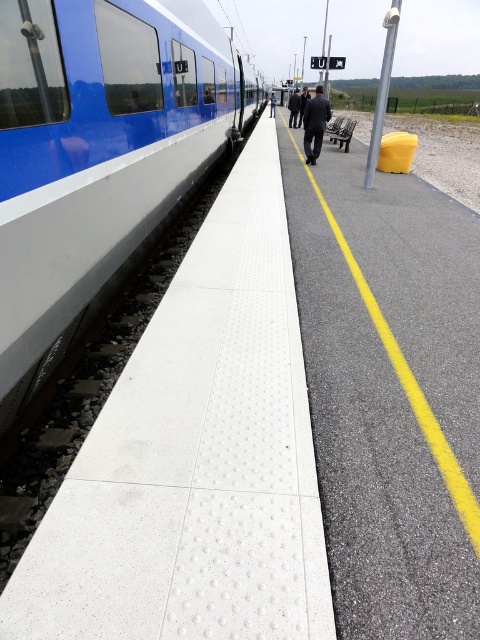
Does point (20, 188) come farther from viewer compared to point (305, 152)?

No, it is not.

Identify the location of blue glossy train at left. (98, 156).

This screenshot has width=480, height=640. I want to click on dark gray suit at center, so click(314, 124).

Does dark gray suit at center appear under black fabric coat at center?

Indeed, dark gray suit at center is positioned under black fabric coat at center.

This screenshot has width=480, height=640. Identify the location of dark gray suit at center. (314, 124).

Locate an element on the screen. The width and height of the screenshot is (480, 640). dark gray suit at center is located at coordinates (314, 124).

Between blue glossy train at left and black fabric coat at center, which one is positioned lower?

blue glossy train at left is lower down.

Where is `blue glossy train at left`? blue glossy train at left is located at coordinates (98, 156).